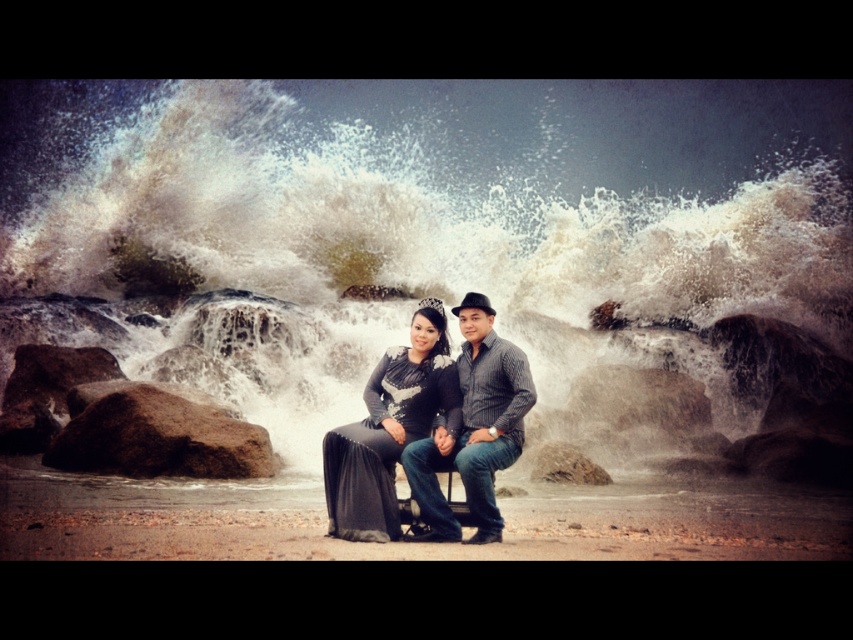
Question: Does white textured water at center appear on the right side of brown rock at lower left?

Choices:
 (A) yes
 (B) no

Answer: (A)

Question: Which point is farther to the camera?

Choices:
 (A) white textured water at center
 (B) matte black dress at center

Answer: (A)

Question: Is matte black dress at center positioned at the back of brown rock at lower left?

Choices:
 (A) yes
 (B) no

Answer: (B)

Question: Which point is closer to the camera?

Choices:
 (A) (334, 451)
 (B) (672, 161)

Answer: (A)

Question: Among these objects, which one is nearest to the camera?

Choices:
 (A) matte black dress at center
 (B) brown rock at lower left
 (C) white textured water at center

Answer: (A)

Question: Is white textured water at center below brown rock at lower left?

Choices:
 (A) yes
 (B) no

Answer: (B)